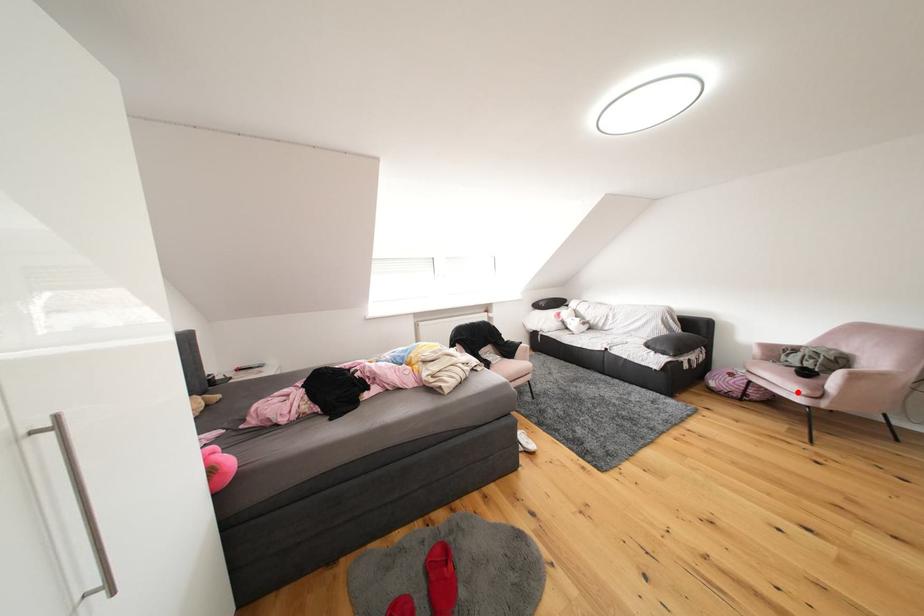
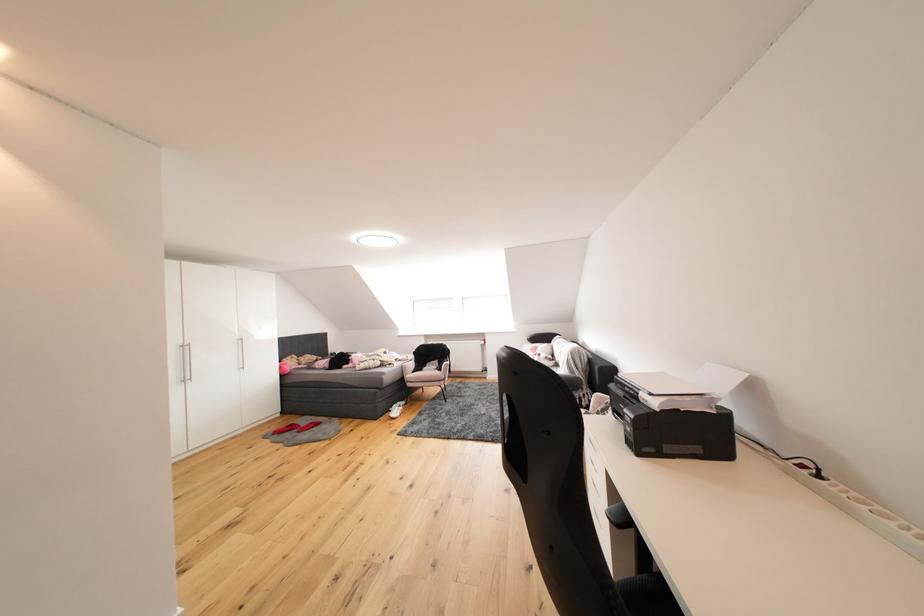
Question: I am providing you with two images of the same scene from different viewpoints. A red point is marked on the first image. Can you still see the location of the red point in image 2?

Choices:
 (A) Yes
 (B) No

Answer: (B)